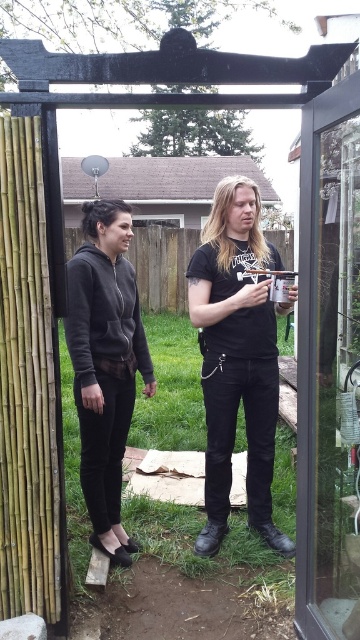
You are trying to determine if the transparent glass screen door at right can fit over the dark gray hoodie at center. Based on their heights, can the door be placed on top of the hoodie without any part of the hoodie sticking out?

The transparent glass screen door at right is taller than the dark gray hoodie at center, so yes, the door can be placed on top of the dark gray hoodie at center without any part of the hoodie sticking out.

You are standing in the backyard and want to enter the house through the transparent glass screen door at right. Based on the coordinates provided in the description, can you estimate the door is closer to the fence or the house?

The transparent glass screen door at right is located at point coordinates with a y value of 0.914, which is closer to 1.0, indicating it is positioned near the bottom of the image. Since the house is likely at the top of the image, the door is closer to the fence, which is part of the backyard setting at the bottom.